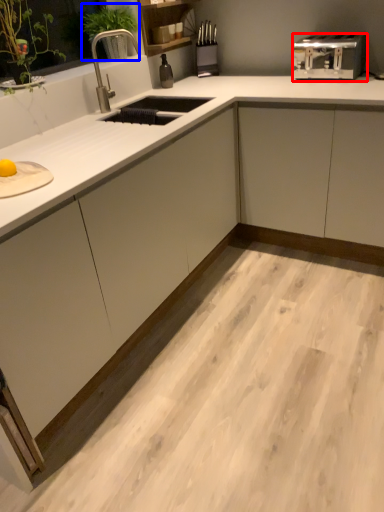
Question: Which object is further to the camera taking this photo, toaster (highlighted by a red box) or plant (highlighted by a blue box)?

Choices:
 (A) toaster
 (B) plant

Answer: (B)